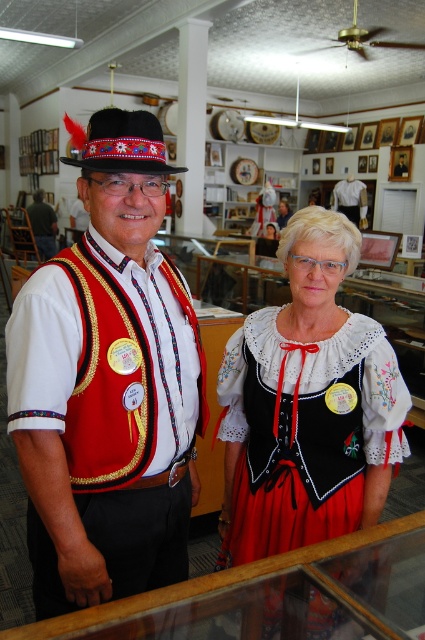
Does embroidered cotton blouse at center have a greater width compared to matte red vest at center?

No.

Between embroidered cotton blouse at center and matte red vest at center, which one is positioned lower?

embroidered cotton blouse at center

What do you see at coordinates (308, 404) in the screenshot? The height and width of the screenshot is (640, 425). I see `embroidered cotton blouse at center` at bounding box center [308, 404].

At what (x,y) coordinates should I click in order to perform the action: click on embroidered cotton blouse at center. Please return your answer as a coordinate pair (x, y). The height and width of the screenshot is (640, 425). Looking at the image, I should click on (308, 404).

Can you confirm if matte red vest at left is wider than embroidered cotton blouse at center?

No, matte red vest at left is not wider than embroidered cotton blouse at center.

Who is more forward, (x=62, y=269) or (x=320, y=448)?

Point (x=62, y=269)

Describe the element at coordinates (115, 397) in the screenshot. I see `matte red vest at left` at that location.

This screenshot has height=640, width=425. What are the coordinates of `matte red vest at left` in the screenshot? It's located at (115, 397).

At what (x,y) coordinates should I click in order to perform the action: click on matte red vest at left. Please return your answer as a coordinate pair (x, y). Image resolution: width=425 pixels, height=640 pixels. Looking at the image, I should click on (115, 397).

You are a GUI agent. You are given a task and a screenshot of the screen. Output one action in this format:
    pyautogui.click(x=<x>, y=<y>)
    Task: Click on the matte red vest at left
    The image size is (425, 640).
    Given the screenshot: What is the action you would take?
    pyautogui.click(x=115, y=397)